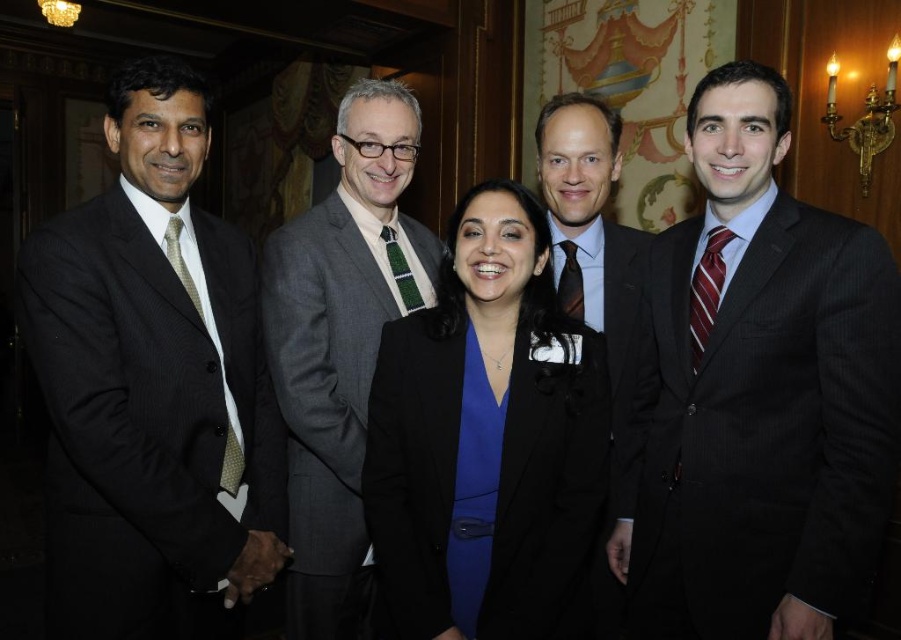
Question: Can you confirm if dark pinstripe suit at right is positioned above dark gray suit at center?

Choices:
 (A) yes
 (B) no

Answer: (B)

Question: Is black pinstripe suit at left to the left of black matte blazer at center from the viewer's perspective?

Choices:
 (A) no
 (B) yes

Answer: (B)

Question: Based on their relative distances, which object is farther from the dark gray suit at center?

Choices:
 (A) gray wool suit at center
 (B) dark pinstripe suit at right
 (C) black pinstripe suit at left
 (D) black matte blazer at center

Answer: (C)

Question: Is gray wool suit at center bigger than dark gray suit at center?

Choices:
 (A) yes
 (B) no

Answer: (A)

Question: Which object appears closest to the camera in this image?

Choices:
 (A) dark gray suit at center
 (B) black pinstripe suit at left

Answer: (B)

Question: Which point is farther to the camera?

Choices:
 (A) (202, 586)
 (B) (481, 285)

Answer: (A)